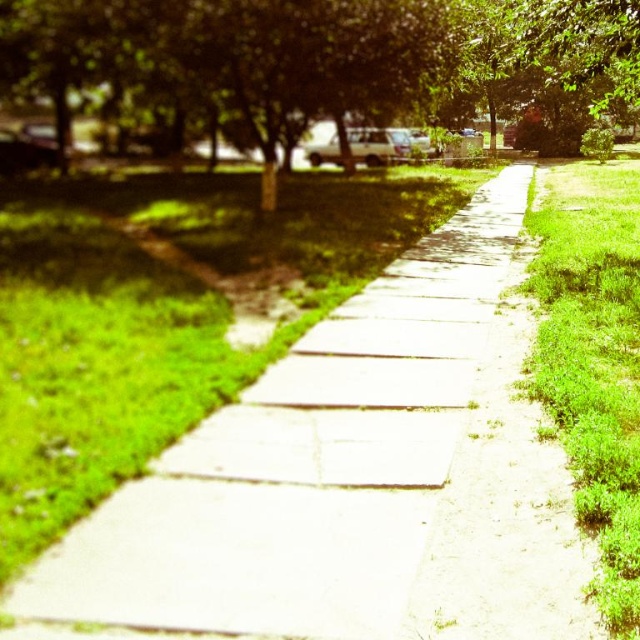
You are a gardener planning to water the green leafy tree at center and the green grass at right. If your watering can has a capacity of 10 liters and each liter covers 1 square meter, how many liters do you need to water both areas?

The question cannot be answered with the provided information because the distance between the green leafy tree at center and green grass at right is given, but the area to be watered for each is not specified.

You are standing on the paved pathway and want to walk towards the green grass at right. Which direction should you turn to avoid the green leafy tree at center?

To avoid the green leafy tree at center, you should turn towards the green grass at right since the tree is closer to you and blocking the path. The green grass at right is farther away but positioned to the side, so turning towards it would allow you to bypass the tree.